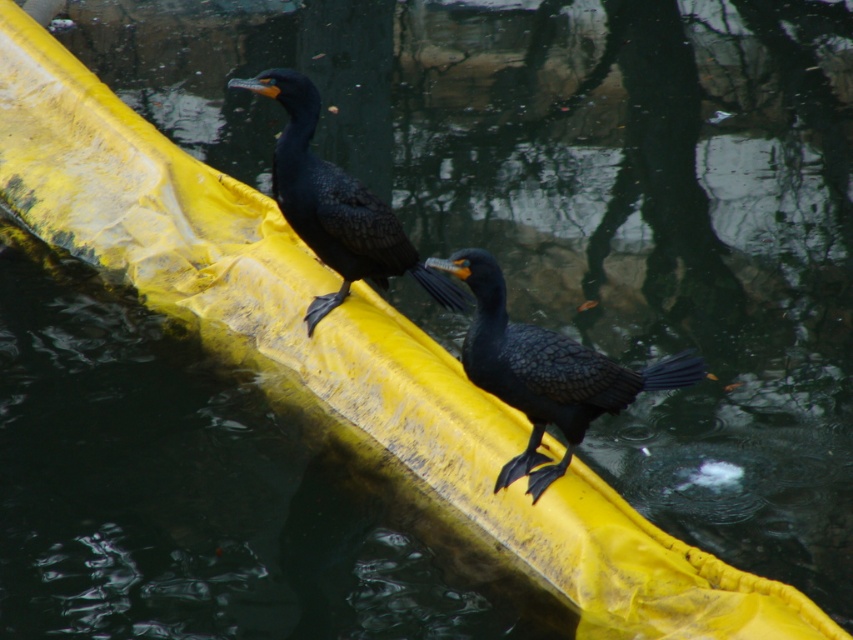
Question: Can you confirm if shiny black bird at center is smaller than shiny black cormorant at upper center?

Choices:
 (A) no
 (B) yes

Answer: (B)

Question: Is shiny black bird at center above shiny black cormorant at upper center?

Choices:
 (A) no
 (B) yes

Answer: (A)

Question: Which object is closer to the camera taking this photo?

Choices:
 (A) shiny black cormorant at upper center
 (B) shiny black bird at center

Answer: (B)

Question: Which of the following is the closest to the observer?

Choices:
 (A) (281, 141)
 (B) (544, 412)

Answer: (B)

Question: Does shiny black bird at center lie behind shiny black cormorant at upper center?

Choices:
 (A) yes
 (B) no

Answer: (B)

Question: Which point is farther from the camera taking this photo?

Choices:
 (A) (497, 483)
 (B) (320, 212)

Answer: (B)